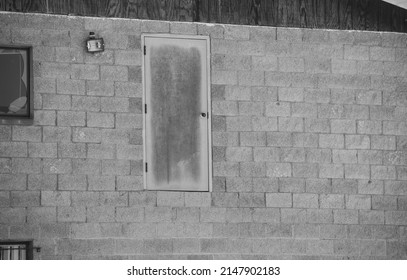
Find the location of a particular element. Image resolution: width=407 pixels, height=280 pixels. attic is located at coordinates (231, 11).